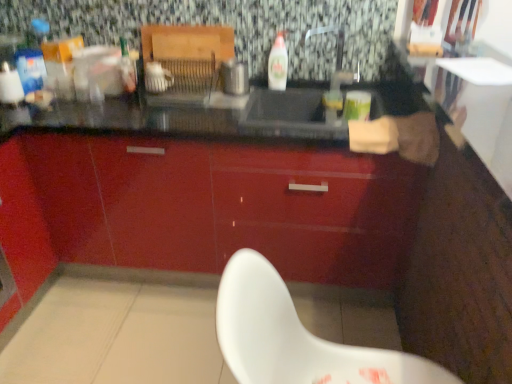
Describe the element at coordinates (297, 338) in the screenshot. The width and height of the screenshot is (512, 384). I see `white plastic chair at lower center` at that location.

Locate an element on the screen. The height and width of the screenshot is (384, 512). metallic silver toaster at center is located at coordinates (234, 77).

Measure the distance between point [222,77] and camera.

Point [222,77] and camera are 2.05 meters apart.

Locate an element on the screen. white plastic chair at lower center is located at coordinates (297, 338).

How many degrees apart are the facing directions of glossy red cabinet at center and metallic silver toaster at center?

The angle between the facing direction of glossy red cabinet at center and the facing direction of metallic silver toaster at center is 0.0701 degrees.

Looking at this image, between glossy red cabinet at center and metallic silver toaster at center, which one has smaller width?

metallic silver toaster at center is thinner.

Who is bigger, glossy red cabinet at center or metallic silver toaster at center?

glossy red cabinet at center.

Between glossy red cabinet at center and metallic silver toaster at center, which one has less height?

Standing shorter between the two is metallic silver toaster at center.

Is metallic silver toaster at center at the back of white plastic chair at lower center?

No, white plastic chair at lower center is not facing the opposite direction of metallic silver toaster at center.

From the image's perspective, is white plastic chair at lower center located beneath metallic silver toaster at center?

Correct, white plastic chair at lower center appears lower than metallic silver toaster at center in the image.

From the picture: Is white plastic chair at lower center next to metallic silver toaster at center?

No, white plastic chair at lower center is not in contact with metallic silver toaster at center.

Which is in front, point (278, 311) or point (241, 95)?

The point (278, 311) is more forward.

From the image's perspective, relative to glossy red cabinet at center, is white plastic chair at lower center above or below?

From the image's perspective, white plastic chair at lower center appears below glossy red cabinet at center.

Between white plastic chair at lower center and glossy red cabinet at center, which one has less height?

With less height is white plastic chair at lower center.

How far apart are white plastic chair at lower center and glossy red cabinet at center?

white plastic chair at lower center is 39.29 inches from glossy red cabinet at center.

In terms of width, does white plastic chair at lower center look wider or thinner when compared to glossy red cabinet at center?

Considering their sizes, white plastic chair at lower center looks slimmer than glossy red cabinet at center.

From a real-world perspective, between metallic silver toaster at center and glossy red cabinet at center, who is vertically lower?

In real-world perspective, glossy red cabinet at center is lower.

From the image's perspective, does metallic silver toaster at center appear higher than glossy red cabinet at center?

Yes, from the image's perspective, metallic silver toaster at center is above glossy red cabinet at center.

In the scene shown: Is glossy red cabinet at center surrounded by metallic silver toaster at center?

No.

Identify the location of bottle above the metallic silver toaster at center (from a real-world perspective). (278, 64).

In the image, is white glossy bottle at center positioned in front of or behind metallic silver toaster at center?

white glossy bottle at center is positioned farther from the viewer than metallic silver toaster at center.

Is white glossy bottle at center oriented away from metallic silver toaster at center?

No, metallic silver toaster at center is not at the back of white glossy bottle at center.

Is white glossy bottle at center next to metallic silver toaster at center?

No, white glossy bottle at center is not making contact with metallic silver toaster at center.

Identify the location of chair on the right of metallic silver toaster at center. (297, 338).

Could you tell me if metallic silver toaster at center is turned towards white plastic chair at lower center?

No, metallic silver toaster at center does not turn towards white plastic chair at lower center.

How far apart are metallic silver toaster at center and white plastic chair at lower center?

metallic silver toaster at center and white plastic chair at lower center are 4.51 feet apart.

Between metallic silver toaster at center and white plastic chair at lower center, which one has larger width?

white plastic chair at lower center is wider.

Relative to white glossy bottle at center, is metallic silver toaster at center in front or behind?

Visually, metallic silver toaster at center is located in front of white glossy bottle at center.

Can you tell me how much metallic silver toaster at center and white glossy bottle at center differ in facing direction?

The facing directions of metallic silver toaster at center and white glossy bottle at center are 1.04 degrees apart.

Is metallic silver toaster at center wider or thinner than white glossy bottle at center?

Considering their sizes, metallic silver toaster at center looks broader than white glossy bottle at center.

Where is `appliance behind the glossy red cabinet at center`? Image resolution: width=512 pixels, height=384 pixels. appliance behind the glossy red cabinet at center is located at coordinates (234, 77).

Identify the location of chair located below the metallic silver toaster at center (from the image's perspective). (297, 338).

Considering their positions, is metallic silver toaster at center positioned closer to white plastic chair at lower center than white glossy bottle at center?

metallic silver toaster at center is positioned closer to the anchor white plastic chair at lower center.

Looking at the image, which one is located further to metallic silver toaster at center, glossy red cabinet at center or white glossy bottle at center?

glossy red cabinet at center is positioned further to the anchor metallic silver toaster at center.

When comparing their distances from glossy red cabinet at center, does metallic silver toaster at center or white plastic chair at lower center seem closer?

metallic silver toaster at center.

Based on the photo, looking at the image, which one is located closer to glossy red cabinet at center, white plastic chair at lower center or metallic silver toaster at center?

Among the two, metallic silver toaster at center is located nearer to glossy red cabinet at center.

Considering their positions, is glossy red cabinet at center positioned closer to white plastic chair at lower center than white glossy bottle at center?

glossy red cabinet at center lies closer to white plastic chair at lower center than the other object.

Which object lies further to the anchor point white glossy bottle at center, white plastic chair at lower center or glossy red cabinet at center?

white plastic chair at lower center.

When comparing their distances from white glossy bottle at center, does glossy red cabinet at center or white plastic chair at lower center seem further?

white plastic chair at lower center lies further to white glossy bottle at center than the other object.

Based on their spatial positions, is metallic silver toaster at center or white plastic chair at lower center further from white glossy bottle at center?

Based on the image, white plastic chair at lower center appears to be further to white glossy bottle at center.

Where is `cabinetry between white plastic chair at lower center and white glossy bottle at center from front to back`? The width and height of the screenshot is (512, 384). cabinetry between white plastic chair at lower center and white glossy bottle at center from front to back is located at coordinates [x=201, y=208].

Locate an element on the screen. This screenshot has height=384, width=512. cabinetry between white plastic chair at lower center and metallic silver toaster at center in the front-back direction is located at coordinates (x=201, y=208).

I want to click on appliance between white plastic chair at lower center and white glossy bottle at center in the front-back direction, so click(234, 77).

The height and width of the screenshot is (384, 512). Find the location of `appliance between white glossy bottle at center and glossy red cabinet at center vertically`. appliance between white glossy bottle at center and glossy red cabinet at center vertically is located at coordinates (234, 77).